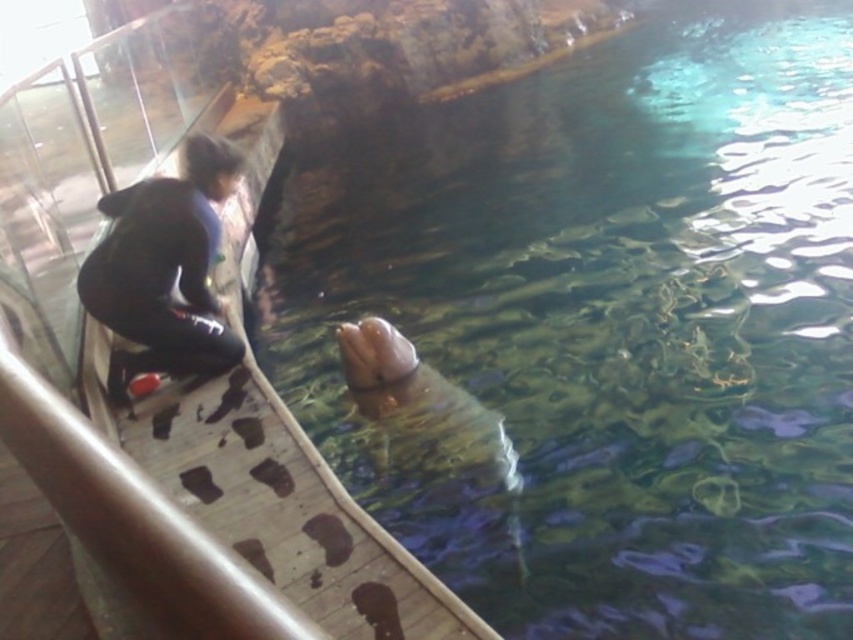
Question: Does clear water at seal upper have a smaller size compared to black matte jacket at left?

Choices:
 (A) yes
 (B) no

Answer: (B)

Question: Can you confirm if clear water at seal upper is wider than black matte jacket at left?

Choices:
 (A) yes
 (B) no

Answer: (A)

Question: Does clear water at seal upper appear on the left side of black matte jacket at left?

Choices:
 (A) no
 (B) yes

Answer: (A)

Question: Which of the following is the farthest from the observer?

Choices:
 (A) (207, 316)
 (B) (573, 243)

Answer: (B)

Question: Which object appears closest to the camera in this image?

Choices:
 (A) clear water at seal upper
 (B) black matte jacket at left

Answer: (A)